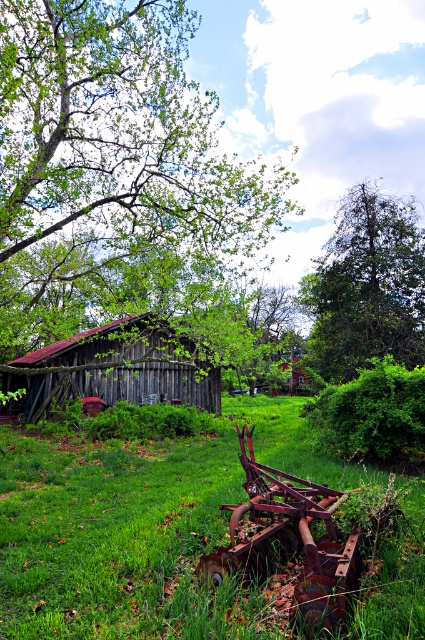
Is green grassy at lower center closer to the viewer compared to rusty metal tractor at lower center?

That is True.

Which of these two, green grassy at lower center or rusty metal tractor at lower center, stands shorter?

rusty metal tractor at lower center

Is point (178, 556) positioned behind point (300, 483)?

That is False.

Find the location of `green grassy at lower center`. green grassy at lower center is located at coordinates (141, 529).

Who is lower down, green grassy at lower center or weathered wood hut at left?

green grassy at lower center is lower down.

This screenshot has width=425, height=640. What do you see at coordinates (141, 529) in the screenshot?
I see `green grassy at lower center` at bounding box center [141, 529].

Where is `green grassy at lower center`? green grassy at lower center is located at coordinates (141, 529).

The width and height of the screenshot is (425, 640). Find the location of `green grassy at lower center`. green grassy at lower center is located at coordinates point(141,529).

Who is higher up, rusty metal tractor at lower center or weathered wood hut at left?

Positioned higher is weathered wood hut at left.

Describe the element at coordinates (289, 540) in the screenshot. This screenshot has height=640, width=425. I see `rusty metal tractor at lower center` at that location.

Locate an element on the screen. This screenshot has height=640, width=425. rusty metal tractor at lower center is located at coordinates 289,540.